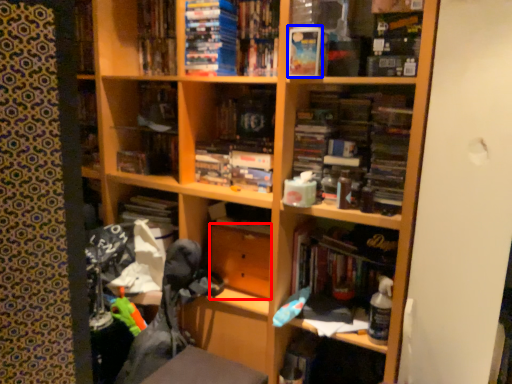
Question: Among these objects, which one is nearest to the camera, drawer (highlighted by a red box) or paperback book (highlighted by a blue box)?

Choices:
 (A) drawer
 (B) paperback book

Answer: (B)